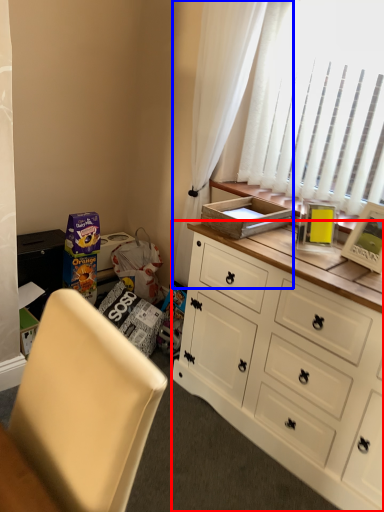
Question: Which object is further to the camera taking this photo, cabinetry (highlighted by a red box) or curtain (highlighted by a blue box)?

Choices:
 (A) cabinetry
 (B) curtain

Answer: (B)